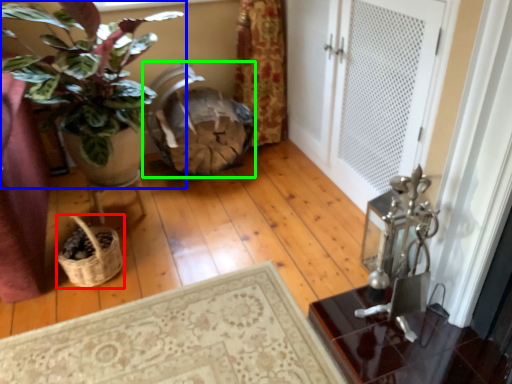
Question: Which object is positioned farthest from basket (highlighted by a red box)? Select from houseplant (highlighted by a blue box) and rocking chair (highlighted by a green box).

Choices:
 (A) houseplant
 (B) rocking chair

Answer: (B)